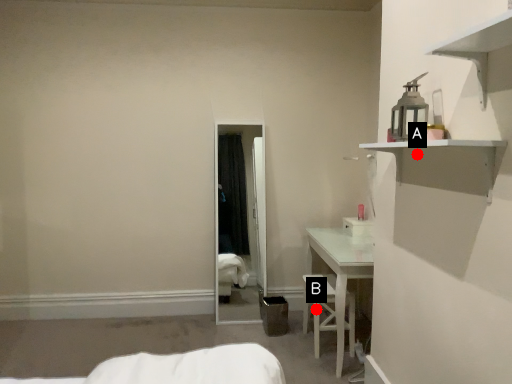
Question: Two points are circled on the image, labeled by A and B beside each circle. Which point is further to the camera?

Choices:
 (A) A is further
 (B) B is further

Answer: (B)